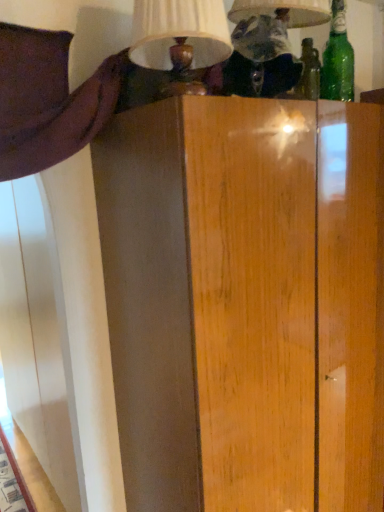
Question: Is matte white lampshade at upper center, positioned as the 2th table lamp in left-to-right order, in contact with matte cream lampshade at upper center, marked as the 1th table lamp in a left-to-right arrangement?

Choices:
 (A) no
 (B) yes

Answer: (A)

Question: From a real-world perspective, does matte white lampshade at upper center, placed as the first table lamp when sorted from right to left, stand above matte cream lampshade at upper center, placed as the second table lamp when sorted from right to left?

Choices:
 (A) no
 (B) yes

Answer: (B)

Question: From a real-world perspective, is matte white lampshade at upper center, positioned as the 2th table lamp in left-to-right order, physically below matte cream lampshade at upper center, marked as the 1th table lamp in a left-to-right arrangement?

Choices:
 (A) no
 (B) yes

Answer: (A)

Question: Can you confirm if matte white lampshade at upper center, positioned as the 2th table lamp in left-to-right order, is positioned to the left of matte cream lampshade at upper center, placed as the second table lamp when sorted from right to left?

Choices:
 (A) no
 (B) yes

Answer: (A)

Question: Does matte white lampshade at upper center, positioned as the 2th table lamp in left-to-right order, come behind matte cream lampshade at upper center, marked as the 1th table lamp in a left-to-right arrangement?

Choices:
 (A) yes
 (B) no

Answer: (A)

Question: Is matte cream lampshade at upper center, marked as the 1th table lamp in a left-to-right arrangement, inside the boundaries of green glass bottle at upper right, or outside?

Choices:
 (A) inside
 (B) outside

Answer: (B)

Question: From the image's perspective, is matte cream lampshade at upper center, placed as the second table lamp when sorted from right to left, positioned above or below green glass bottle at upper right?

Choices:
 (A) above
 (B) below

Answer: (B)

Question: In terms of height, does matte cream lampshade at upper center, marked as the 1th table lamp in a left-to-right arrangement, look taller or shorter compared to green glass bottle at upper right?

Choices:
 (A) tall
 (B) short

Answer: (B)

Question: Would you say matte cream lampshade at upper center, marked as the 1th table lamp in a left-to-right arrangement, is to the left or to the right of green glass bottle at upper right in the picture?

Choices:
 (A) left
 (B) right

Answer: (A)

Question: Is matte white lampshade at upper center, placed as the first table lamp when sorted from right to left, in front of or behind green glass bottle at upper right in the image?

Choices:
 (A) behind
 (B) front

Answer: (B)

Question: From the image's perspective, is matte white lampshade at upper center, positioned as the 2th table lamp in left-to-right order, positioned above or below green glass bottle at upper right?

Choices:
 (A) below
 (B) above

Answer: (A)

Question: In terms of width, does matte white lampshade at upper center, placed as the first table lamp when sorted from right to left, look wider or thinner when compared to green glass bottle at upper right?

Choices:
 (A) wide
 (B) thin

Answer: (A)

Question: Considering the relative positions of matte white lampshade at upper center, placed as the first table lamp when sorted from right to left, and green glass bottle at upper right in the image provided, is matte white lampshade at upper center, placed as the first table lamp when sorted from right to left, to the left or to the right of green glass bottle at upper right?

Choices:
 (A) left
 (B) right

Answer: (A)

Question: Is matte white lampshade at upper center, placed as the first table lamp when sorted from right to left, bigger or smaller than matte cream lampshade at upper center, marked as the 1th table lamp in a left-to-right arrangement?

Choices:
 (A) small
 (B) big

Answer: (B)

Question: Do you think matte white lampshade at upper center, positioned as the 2th table lamp in left-to-right order, is within matte cream lampshade at upper center, placed as the second table lamp when sorted from right to left, or outside of it?

Choices:
 (A) outside
 (B) inside

Answer: (A)